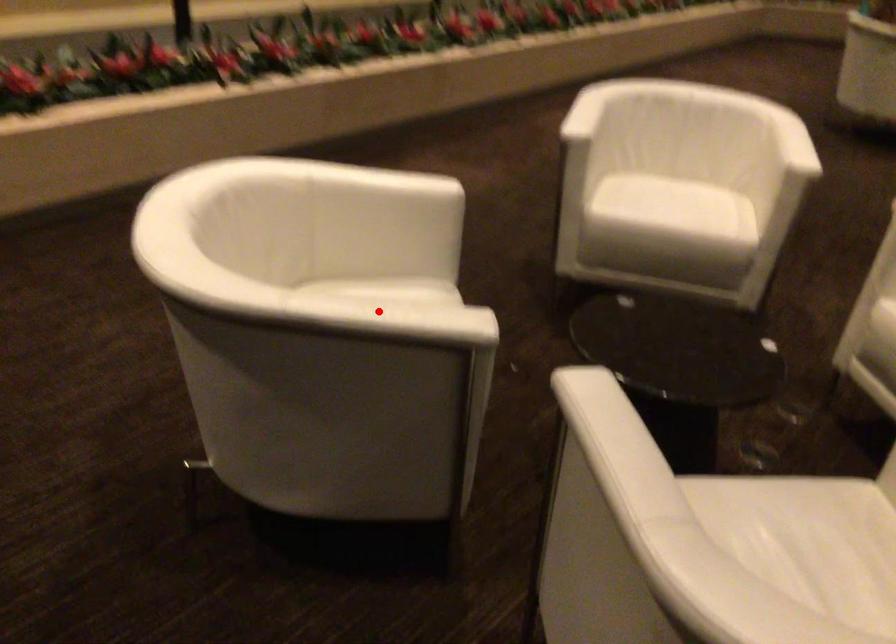
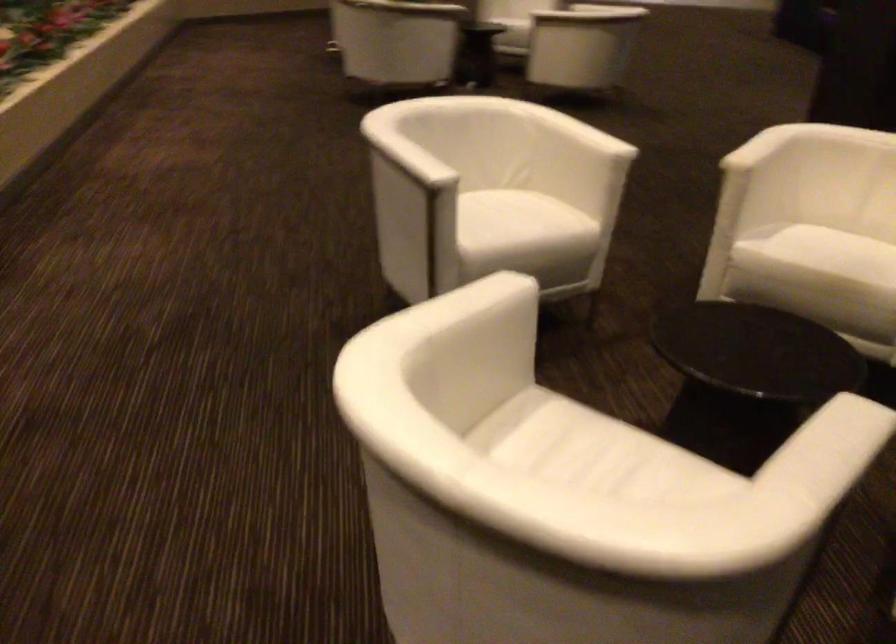
Question: A red point is marked in image1. In image2, is the corresponding 3D point closer to the camera or farther? Reply with the corresponding letter.

Choices:
 (A) The corresponding 3D point is closer.
 (B) The corresponding 3D point is farther.

Answer: (A)